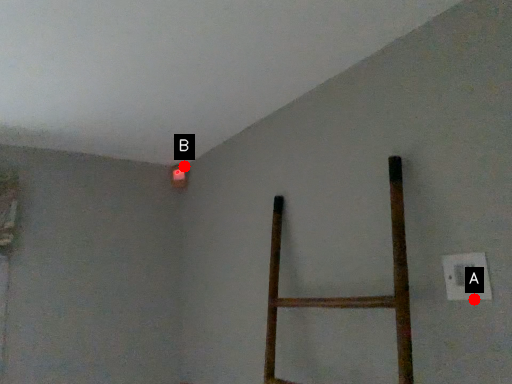
Question: Two points are circled on the image, labeled by A and B beside each circle. Which point is farther from the camera taking this photo?

Choices:
 (A) A is further
 (B) B is further

Answer: (B)